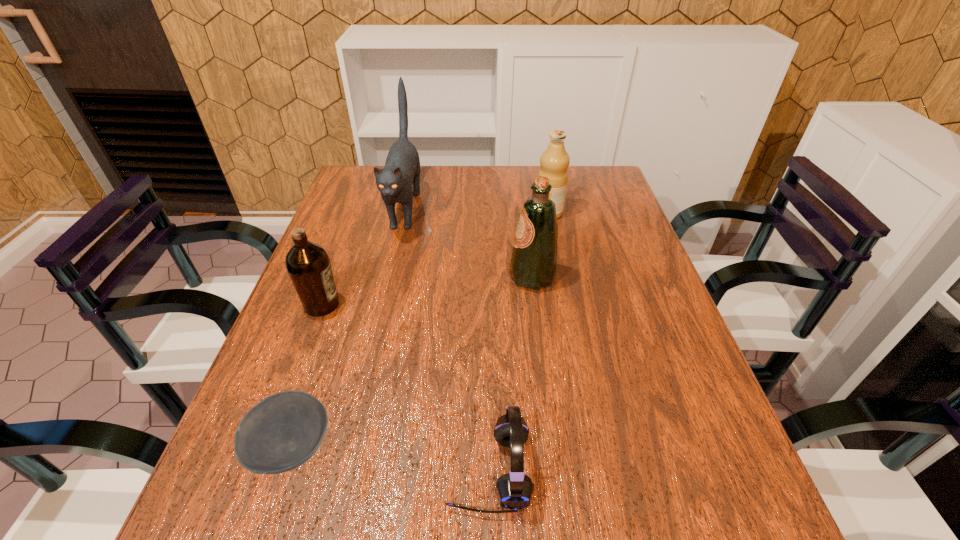
At what (x,y) coordinates should I click in order to perform the action: click on blank space at the left edge. Please return your answer as a coordinate pair (x, y). Looking at the image, I should click on (324, 243).

Where is `vacant space at the right edge of the desktop`? This screenshot has height=540, width=960. vacant space at the right edge of the desktop is located at coordinates (745, 472).

Where is `free space at the far left corner of the desktop`? The width and height of the screenshot is (960, 540). free space at the far left corner of the desktop is located at coordinates (369, 170).

At what (x,y) coordinates should I click in order to perform the action: click on vacant space at the far right corner of the desktop. Please return your answer as a coordinate pair (x, y). This screenshot has width=960, height=540. Looking at the image, I should click on (585, 200).

The height and width of the screenshot is (540, 960). What are the coordinates of `empty space between the farthest olive oil and the fourth tallest object` in the screenshot? It's located at (435, 259).

You are a GUI agent. You are given a task and a screenshot of the screen. Output one action in this format:
    pyautogui.click(x=<x>, y=<y>)
    Task: Click on the free area in between the farthest olive oil and the bowl
    The width and height of the screenshot is (960, 540).
    Given the screenshot: What is the action you would take?
    pyautogui.click(x=420, y=330)

Find the location of a particular element. The height and width of the screenshot is (540, 960). free space between the farthest olive oil and the shortest olive oil is located at coordinates (435, 259).

You are a GUI agent. You are given a task and a screenshot of the screen. Output one action in this format:
    pyautogui.click(x=<x>, y=<y>)
    Task: Click on the vacant area that lies between the tallest object and the fifth tallest object
    Image resolution: width=960 pixels, height=540 pixels.
    Given the screenshot: What is the action you would take?
    pyautogui.click(x=446, y=339)

Identify which object is the fifth closest to the shortest olive oil. Please provide its 2D coordinates. Your answer should be formatted as a tuple, i.e. [(x, y)], where the tuple contains the x and y coordinates of a point satisfying the conditions above.

[(554, 161)]

Identify which object is the nearest to the shortest object. Please provide its 2D coordinates. Your answer should be formatted as a tuple, i.e. [(x, y)], where the tuple contains the x and y coordinates of a point satisfying the conditions above.

[(514, 490)]